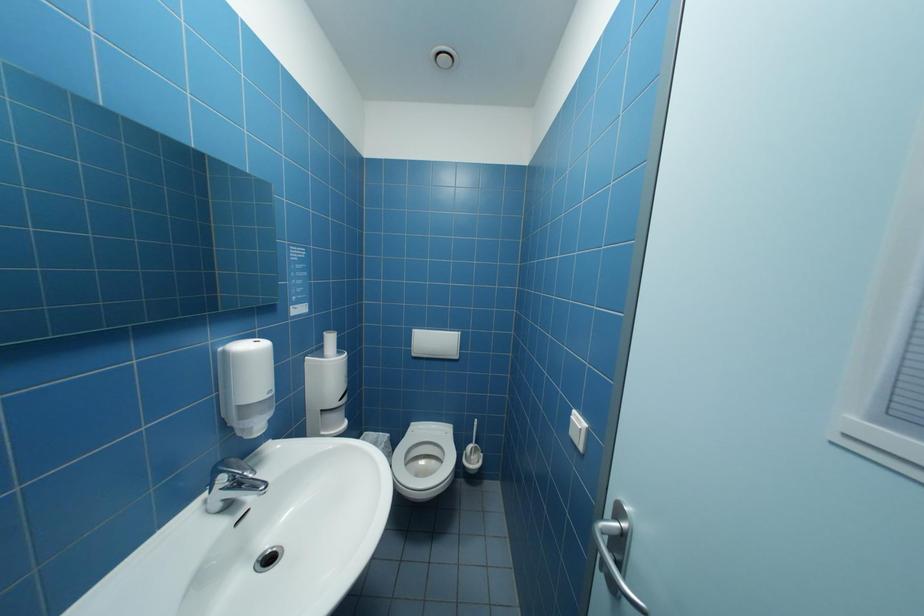
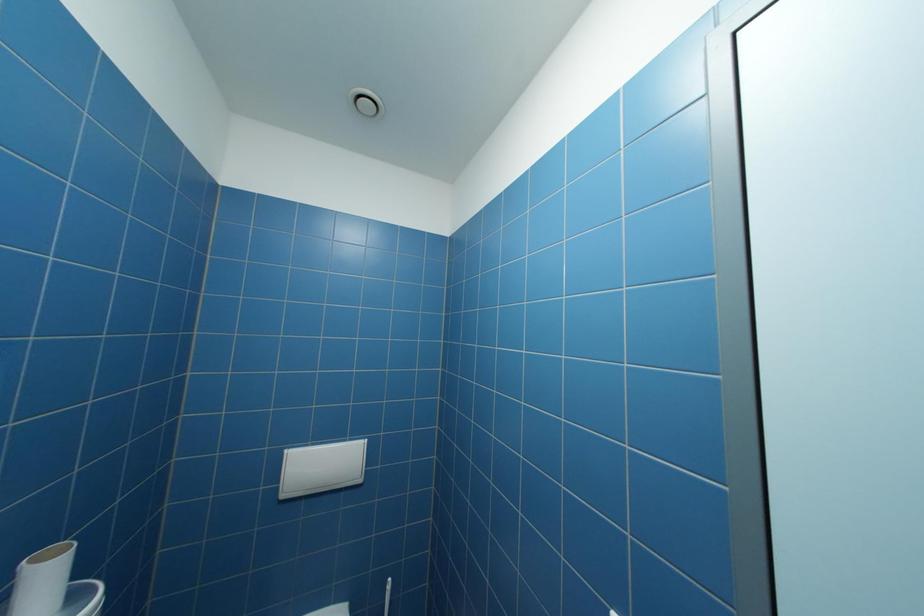
Question: How did the camera likely rotate?

Choices:
 (A) Left
 (B) Right
 (C) Up
 (D) Down

Answer: (B)